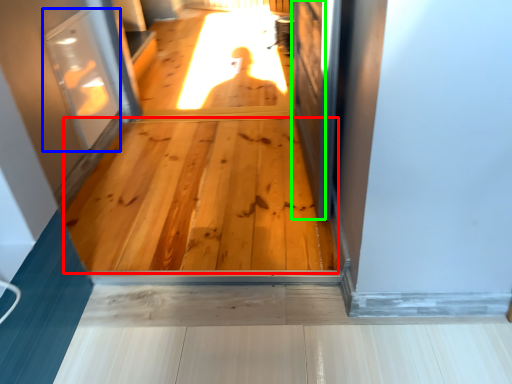
Question: Estimate the real-world distances between objects in this image. Which object is closer to hardwood (highlighted by a red box), screen door (highlighted by a blue box) or screen door (highlighted by a green box)?

Choices:
 (A) screen door
 (B) screen door

Answer: (B)